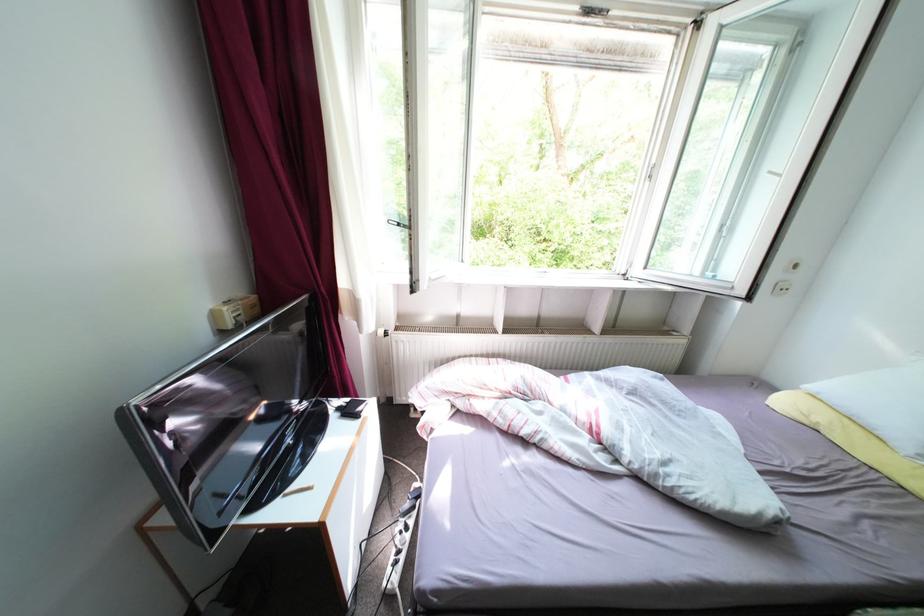
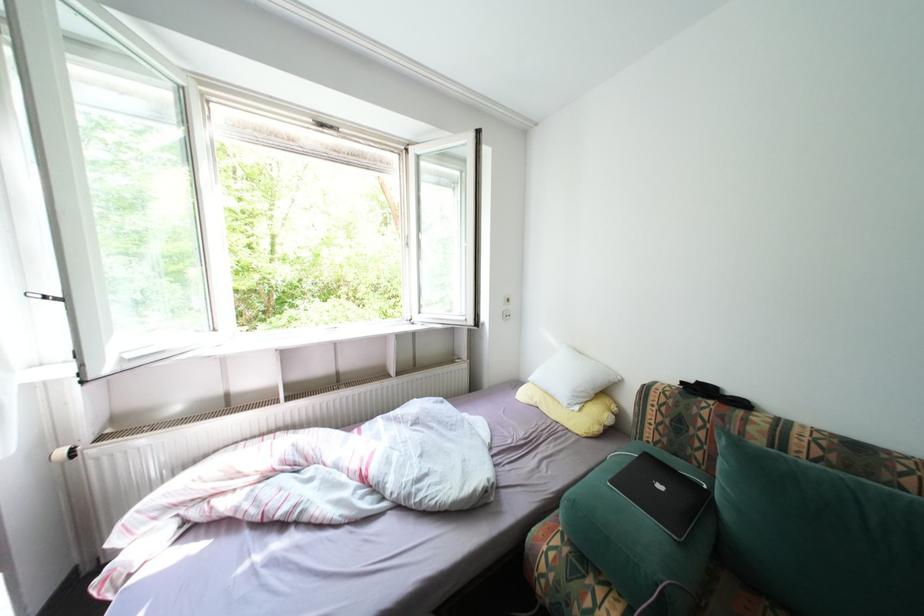
Question: The camera is either moving clockwise (left) or counter-clockwise (right) around the object. The first image is from the beginning of the video and the second image is from the end. Is the camera moving left or right when shooting the video?

Choices:
 (A) Left
 (B) Right

Answer: (A)